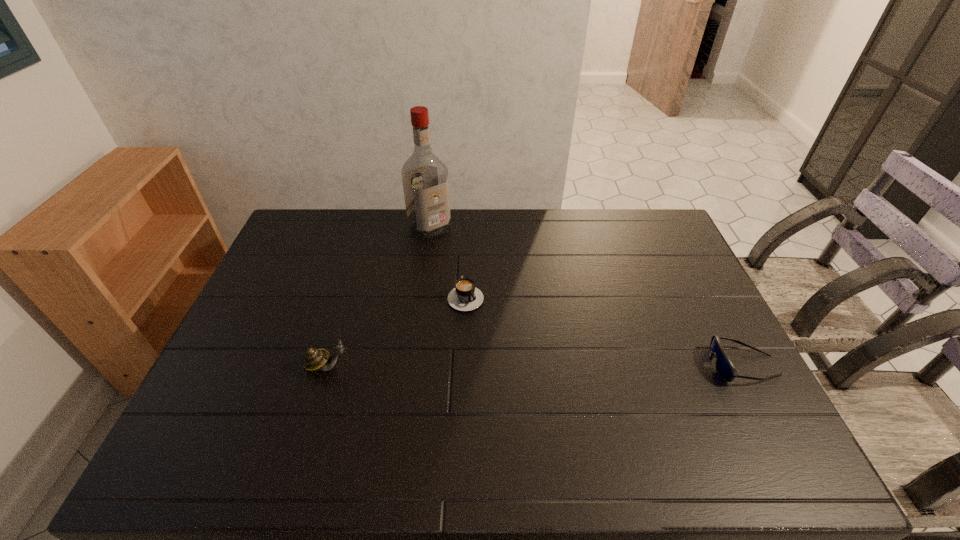
At what (x,y) coordinates should I click in order to perform the action: click on vacant spot on the desktop that is between the third shortest object and the sunglasses and is positioned with the handle on the side of the second farthest object. Please return your answer as a coordinate pair (x, y). The image size is (960, 540). Looking at the image, I should click on (533, 366).

This screenshot has height=540, width=960. I want to click on vacant spot on the desktop that is between the snail and the sunglasses and is positioned on the front-facing side of the third object from right to left, so click(564, 366).